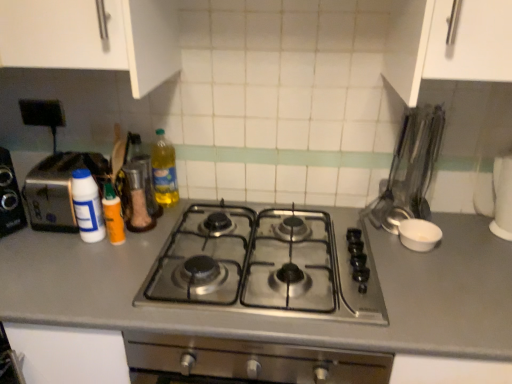
The image size is (512, 384). Identify the location of free space in front of translucent orange bottle at center left, which is counted as the second bottle, starting from the right. (91, 271).